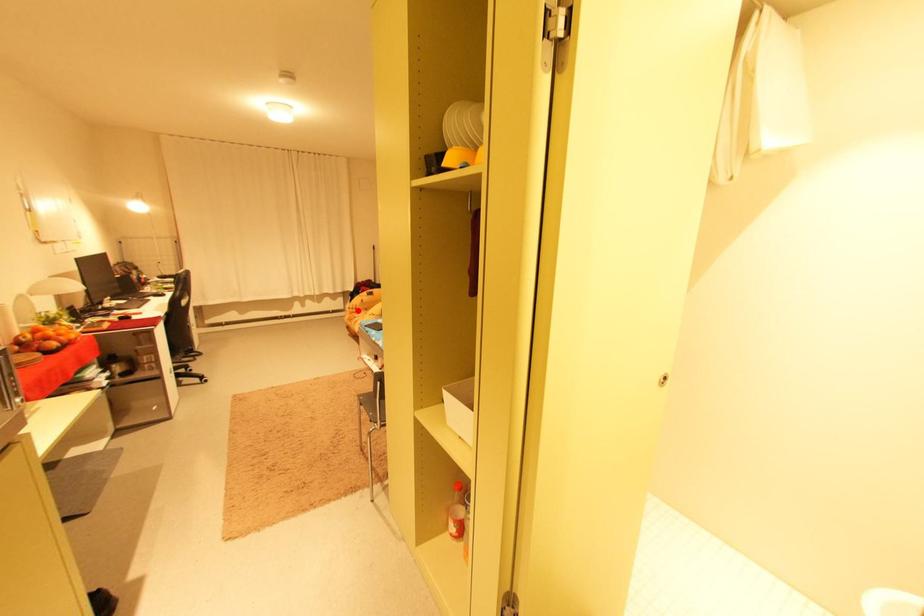
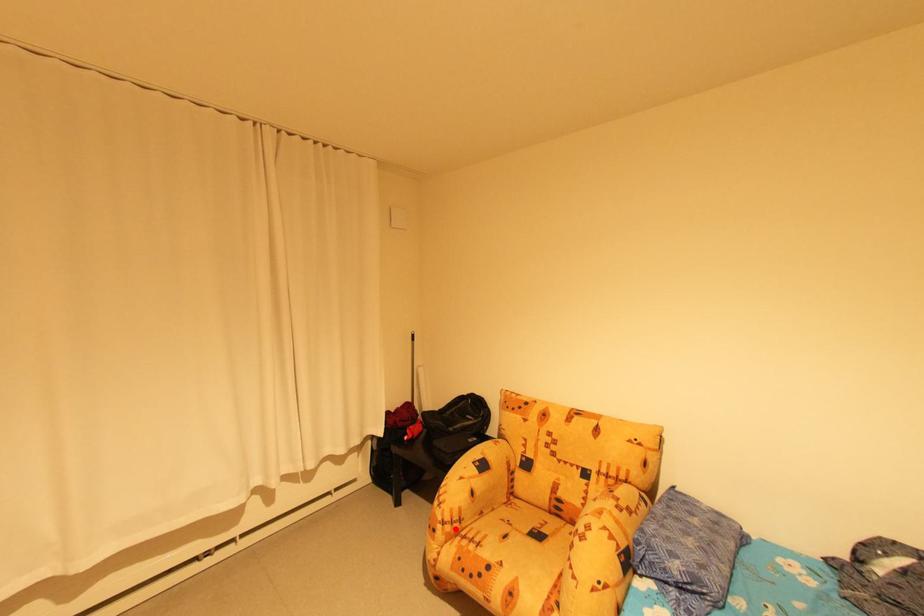
I am providing you with two images of the same scene from different viewpoints. A red point is marked on the first image and another point is marked on the second image. Is the red point in image1 aligned with the point shown in image2?

Yes